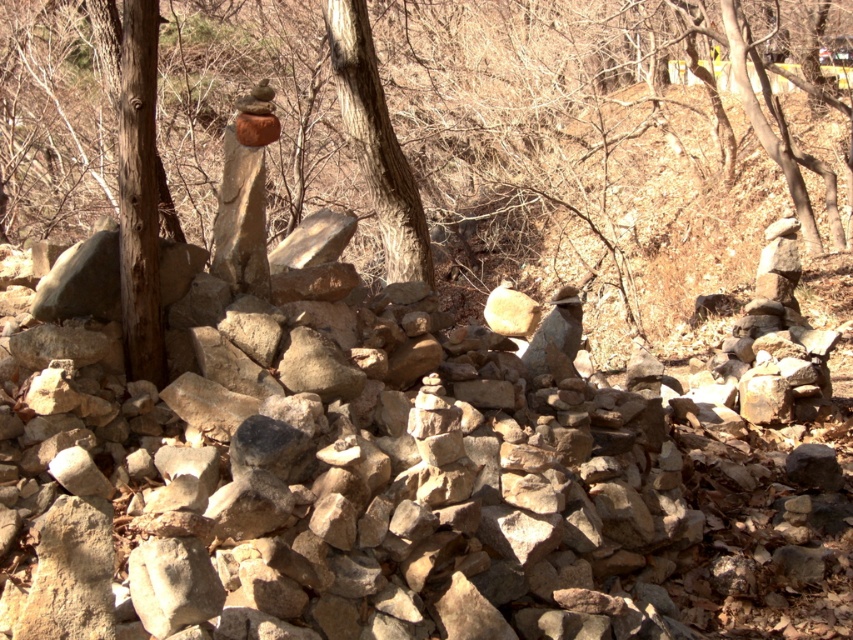
Between point (126, 172) and point (347, 42), which one is positioned in front?

Positioned in front is point (126, 172).

Consider the image. Who is more distant from viewer, (131, 244) or (338, 1)?

Positioned behind is point (338, 1).

Does point (125, 204) come farther from viewer compared to point (364, 56)?

No.

Where is `brown rough wood at left`? brown rough wood at left is located at coordinates (138, 195).

Who is lower down, smooth brown tree trunk at left or brown rough wood at left?

brown rough wood at left is below.

Is smooth brown tree trunk at left behind brown rough wood at left?

Yes, it is behind brown rough wood at left.

At what (x,y) coordinates should I click in order to perform the action: click on smooth brown tree trunk at left. Please return your answer as a coordinate pair (x, y). This screenshot has width=853, height=640. Looking at the image, I should click on (575, 152).

Locate an element on the screen. The image size is (853, 640). smooth brown tree trunk at left is located at coordinates (575, 152).

Does point (657, 179) come farther from viewer compared to point (340, 17)?

That is True.

Locate an element on the screen. smooth brown tree trunk at left is located at coordinates (575, 152).